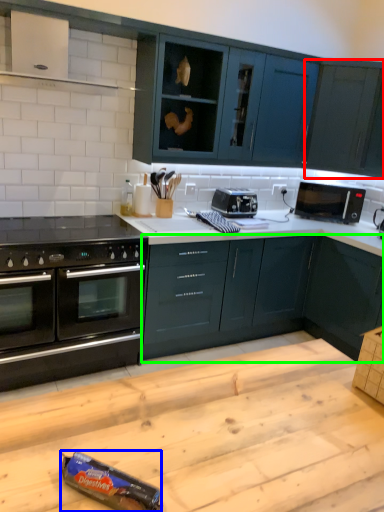
Question: Considering the real-world distances, which object is farthest from cabinetry (highlighted by a red box)? appliance (highlighted by a blue box) or cabinetry (highlighted by a green box)?

Choices:
 (A) appliance
 (B) cabinetry

Answer: (A)